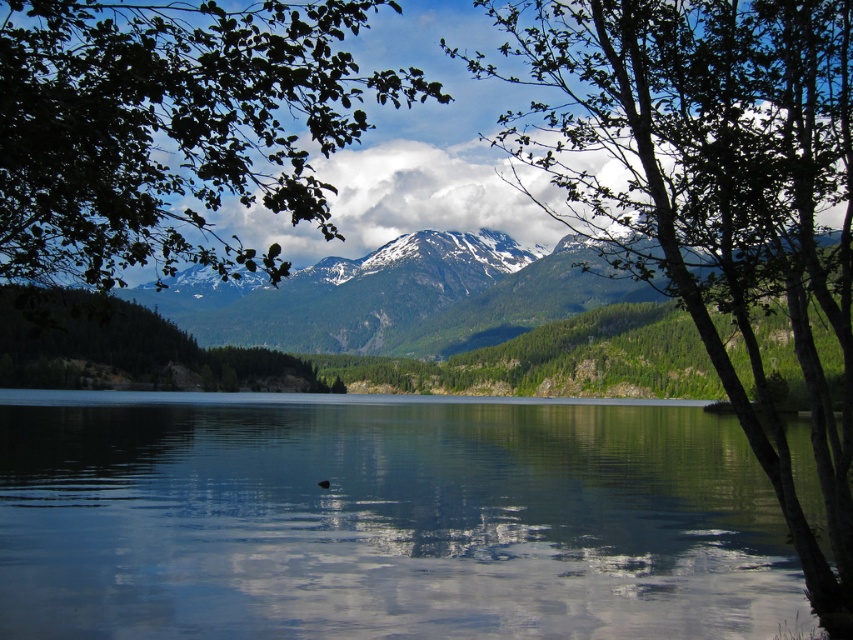
Between transparent water at center and green leafy tree at upper left, which one appears on the left side from the viewer's perspective?

From the viewer's perspective, green leafy tree at upper left appears more on the left side.

Who is more distant from viewer, (488, 465) or (169, 28)?

The point (488, 465) is behind.

This screenshot has width=853, height=640. What do you see at coordinates (383, 520) in the screenshot?
I see `transparent water at center` at bounding box center [383, 520].

What are the coordinates of `transparent water at center` in the screenshot? It's located at (383, 520).

Which of these two, transparent water at center or green leafy tree at center, stands shorter?

With less height is transparent water at center.

Which of these two, transparent water at center or green leafy tree at center, stands taller?

green leafy tree at center is taller.

Identify the location of transparent water at center. This screenshot has width=853, height=640. (383, 520).

Is green leafy tree at center positioned before green leafy tree at upper left?

No.

Does green leafy tree at center have a lesser width compared to green leafy tree at upper left?

Yes, green leafy tree at center is thinner than green leafy tree at upper left.

Where is `green leafy tree at center`? green leafy tree at center is located at coordinates (712, 193).

Locate an element on the screen. This screenshot has width=853, height=640. green leafy tree at center is located at coordinates (712, 193).